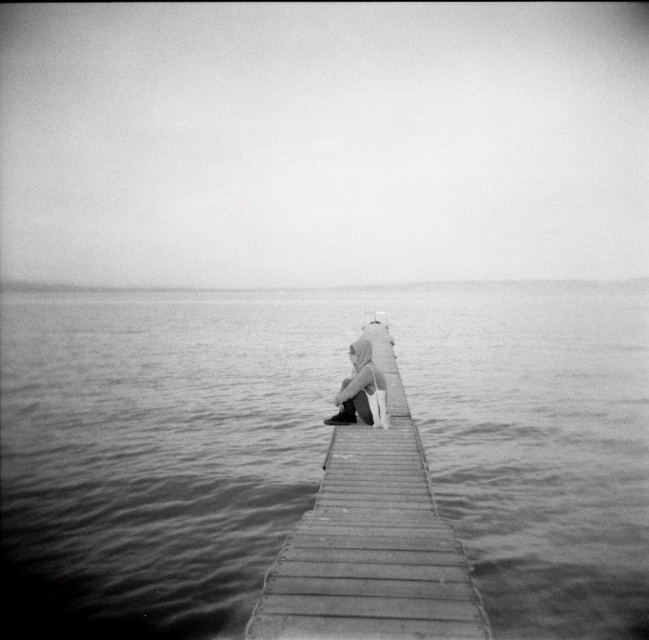
You are a photographer trying to capture the reflection of the dock in the water. The point marked at coordinates point (315, 449) is crucial for your composition. Based on the scene description, where is this point located?

The point marked at coordinates point (315, 449) is located on smooth water at center.

You are standing on the wooden dock at center and want to move to the light gray fabric pants at center. Which direction should you walk to get closer to the pants?

You should walk to the left because the wooden dock at center is to the right of the light gray fabric pants at center, so moving left will bring you closer.

You are a photographer trying to capture the scene of the smooth water at center and the light gray fabric pants at center. Since you want to focus on the water, which object should you zoom in on more, and why?

You should zoom in more on the smooth water at center because its width is greater than the light gray fabric pants at center, allowing for a more expansive and detailed capture of the water.